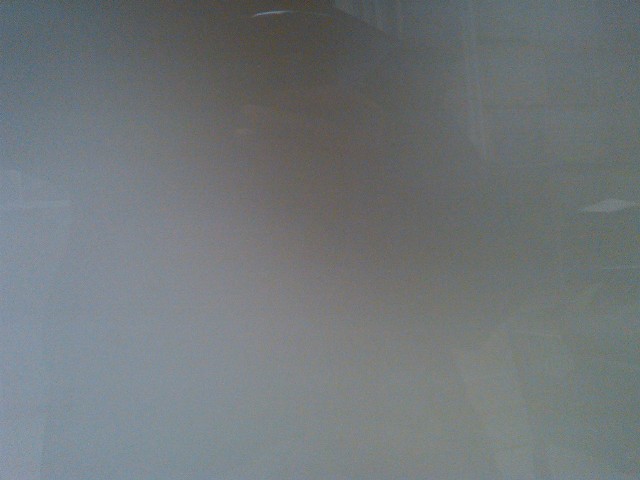
Locate an element on the screen. This screenshot has width=640, height=480. picutre is located at coordinates (282, 423).